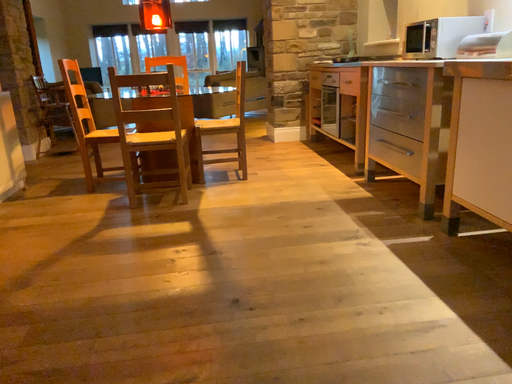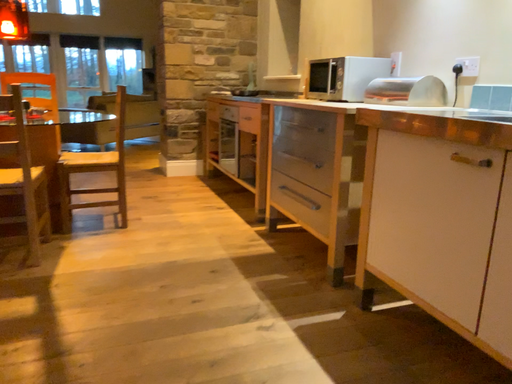
Question: How did the camera likely rotate when shooting the video?

Choices:
 (A) rotated right
 (B) rotated left

Answer: (A)